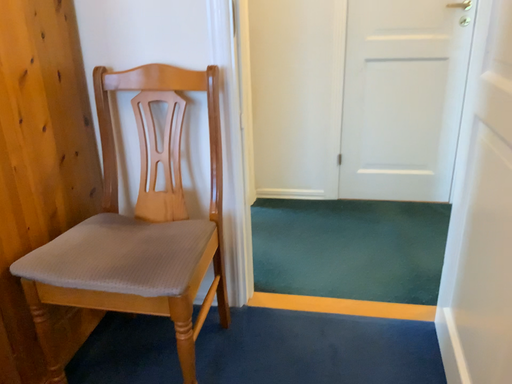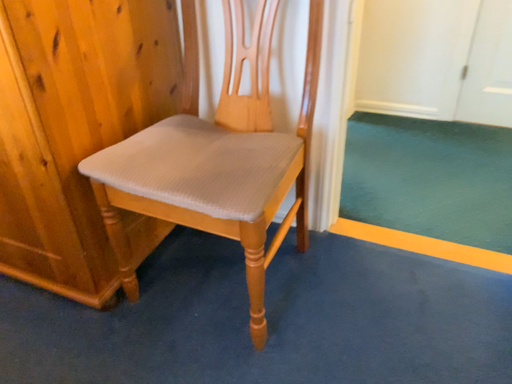
Question: How did the camera likely rotate when shooting the video?

Choices:
 (A) rotated right
 (B) rotated left

Answer: (B)